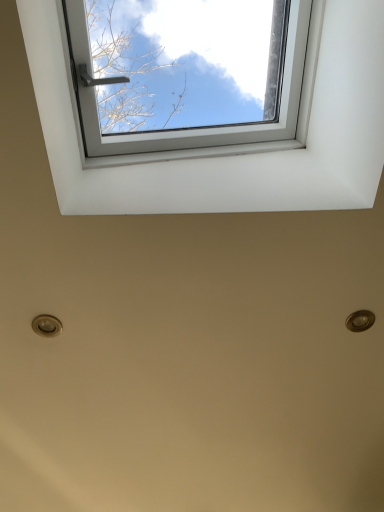
Describe the element at coordinates (237, 147) in the screenshot. I see `transparent glass window at upper center` at that location.

At what (x,y) coordinates should I click in order to perform the action: click on transparent glass window at upper center. Please return your answer as a coordinate pair (x, y). Looking at the image, I should click on (237, 147).

This screenshot has width=384, height=512. What are the coordinates of `transparent glass window at upper center` in the screenshot? It's located at (237, 147).